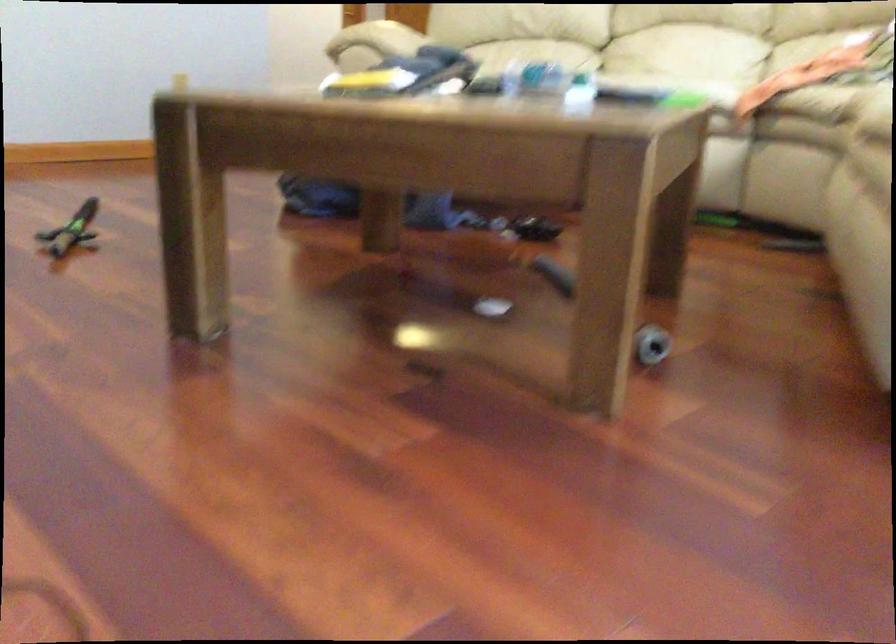
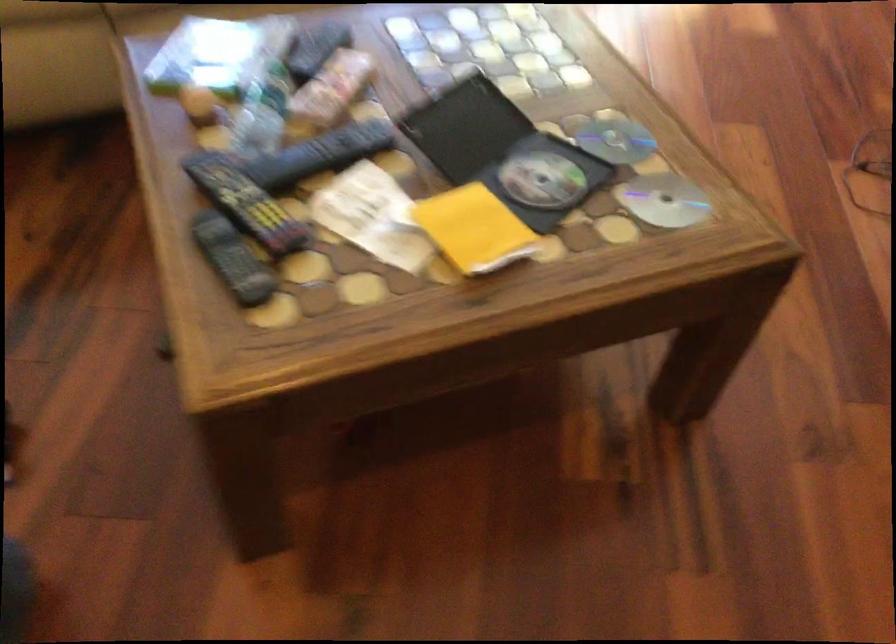
Locate, in the second image, the point that corresponds to the point at 274,100 in the first image.

(664, 200)